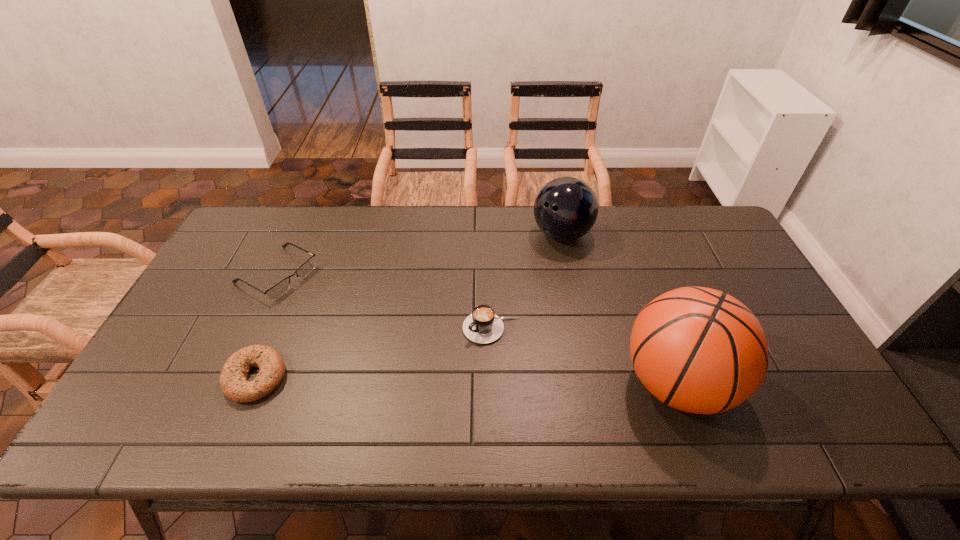
The image size is (960, 540). I want to click on bagel, so click(x=233, y=377).

The height and width of the screenshot is (540, 960). In order to click on the tallest object in this screenshot , I will do `click(699, 350)`.

At what (x,y) coordinates should I click in order to perform the action: click on bowling ball. Please return your answer as a coordinate pair (x, y). This screenshot has width=960, height=540. Looking at the image, I should click on (566, 208).

At what (x,y) coordinates should I click in order to perform the action: click on the third object from right to left. Please return your answer as a coordinate pair (x, y). The image size is (960, 540). Looking at the image, I should click on 483,326.

At what (x,y) coordinates should I click in order to perform the action: click on the third tallest object. Please return your answer as a coordinate pair (x, y). The image size is (960, 540). Looking at the image, I should click on click(483, 326).

I want to click on spectacles, so click(279, 289).

Where is `vacant point located on the back of the bagel`? vacant point located on the back of the bagel is located at coordinates (300, 271).

Find the location of a particular element. The height and width of the screenshot is (540, 960). vacant space located 0.260m on the left of the tallest object is located at coordinates (513, 383).

Locate an element on the screen. This screenshot has width=960, height=540. vacant space located on the side of the second tallest object with the finger holes is located at coordinates (510, 294).

At what (x,y) coordinates should I click in order to perform the action: click on vacant space located on the side of the second tallest object with the finger holes. Please return your answer as a coordinate pair (x, y). This screenshot has height=540, width=960. Looking at the image, I should click on (476, 332).